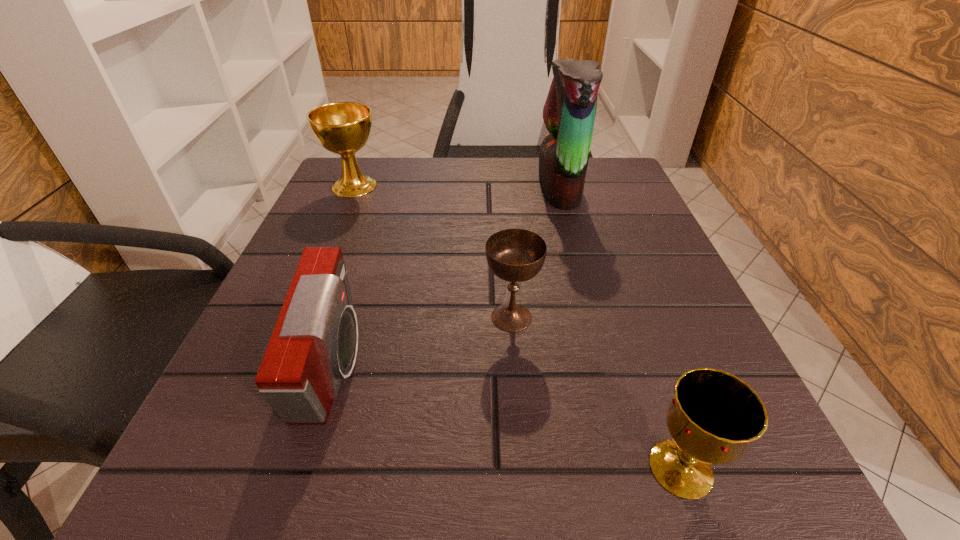
At what (x,y) coordinates should I click in order to perform the action: click on parrot that is at the right edge. Please return your answer as a coordinate pair (x, y). This screenshot has height=540, width=960. Looking at the image, I should click on (569, 112).

Locate an element on the screen. This screenshot has height=540, width=960. chalice that is positioned at the right edge is located at coordinates (714, 415).

At what (x,y) coordinates should I click in order to perform the action: click on object present at the far left corner. Please return your answer as a coordinate pair (x, y). The image size is (960, 540). Looking at the image, I should click on (343, 128).

Find the location of a particular element. Image resolution: width=960 pixels, height=540 pixels. object situated at the near left corner is located at coordinates (314, 344).

I want to click on object present at the far right corner, so click(x=569, y=112).

Identify the location of object that is at the near right corner. The height and width of the screenshot is (540, 960). (714, 415).

The image size is (960, 540). In order to click on free location at the far edge in this screenshot , I will do `click(496, 204)`.

In order to click on vacant region at the near edge of the desktop in this screenshot , I will do `click(590, 451)`.

In the image, there is a desktop. Identify the location of free space at the left edge. (329, 233).

Locate an element on the screen. The width and height of the screenshot is (960, 540). free region at the right edge of the desktop is located at coordinates (676, 269).